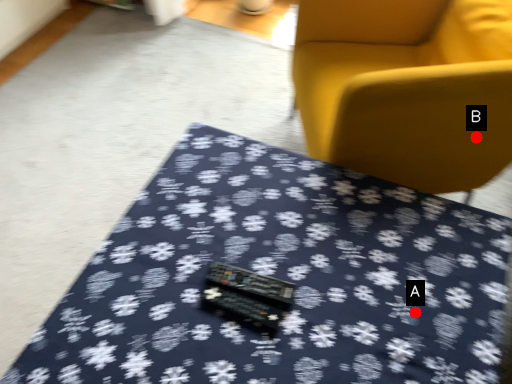
Question: Two points are circled on the image, labeled by A and B beside each circle. Which point is further to the camera?

Choices:
 (A) A is further
 (B) B is further

Answer: (B)